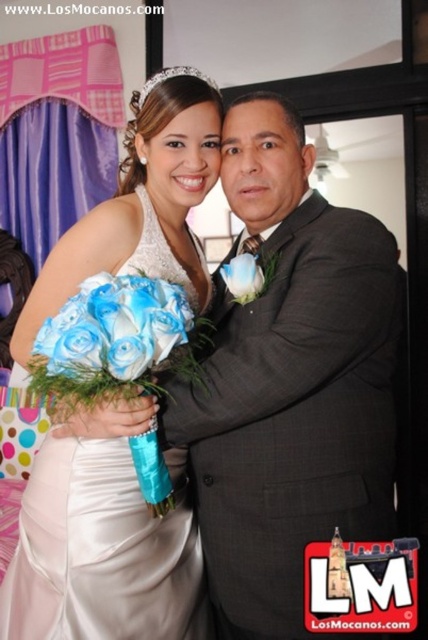
You are a photographer adjusting your camera settings for the wedding scene. You notice two points marked in the image at coordinates point (327, 468) and point (47, 451). Which point should you focus on first if you want to ensure the foreground elements are sharp?

Point (327, 468) is closer to the camera than point (47, 451), so you should focus on point (327, 468) first to ensure the foreground elements are sharp.

You are a photographer setting up for a wedding photo. You have a camera with a focus range that can only capture objects up to 1.5 meters tall. The scene includes a satin white dress at center and blue silk roses at center. Will both objects be in focus if you set your camera to capture up to 1.5 meters?

The satin white dress at center is taller than blue silk roses at center. Since the camera can capture up to 1.5 meters, both objects will be in focus as long as their heights are within this range. However, without specific height measurements, we can confirm that the shorter blue silk roses at center will definitely be within range, but the taller satin white dress at center might exceed 1.5 meters and thus may not be fully in focus.

What object is located at the coordinates point [291,381] in the image?

The point [291,381] marks the gray textured suit at center.